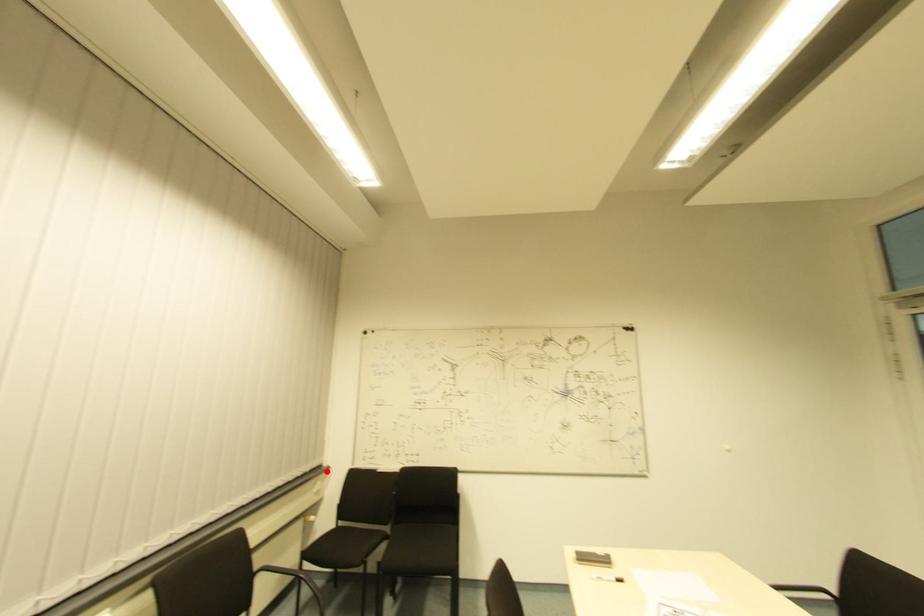
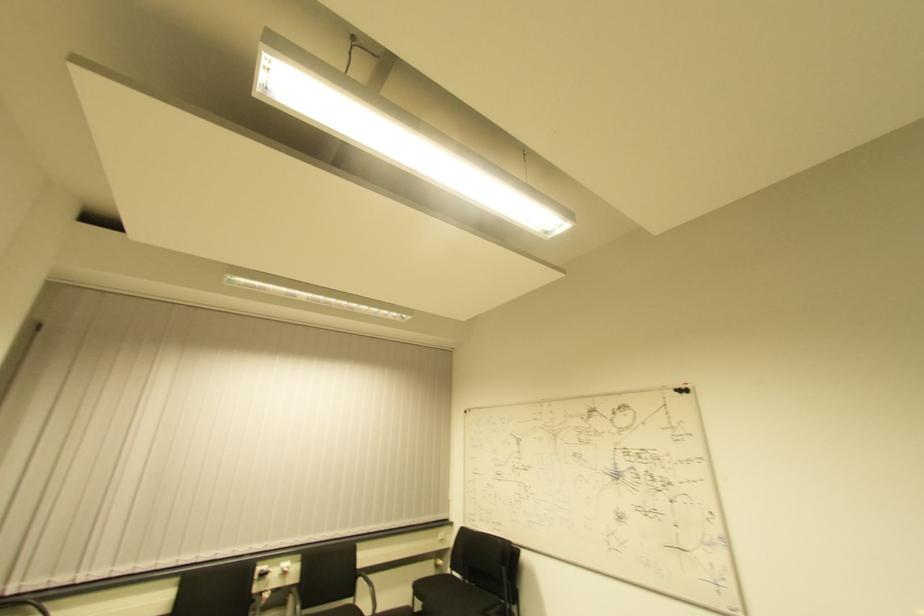
Question: A red point is marked in image1. In image2, is the corresponding 3D point closer to the camera or farther? Reply with the corresponding letter.

Choices:
 (A) The corresponding 3D point is closer.
 (B) The corresponding 3D point is farther.

Answer: (B)